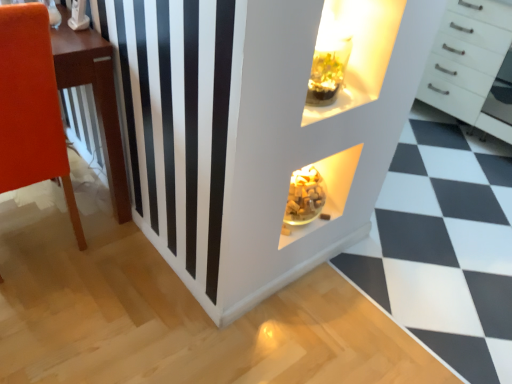
Identify the location of free area below matte orange chair at left (from a real-world perspective). (31, 257).